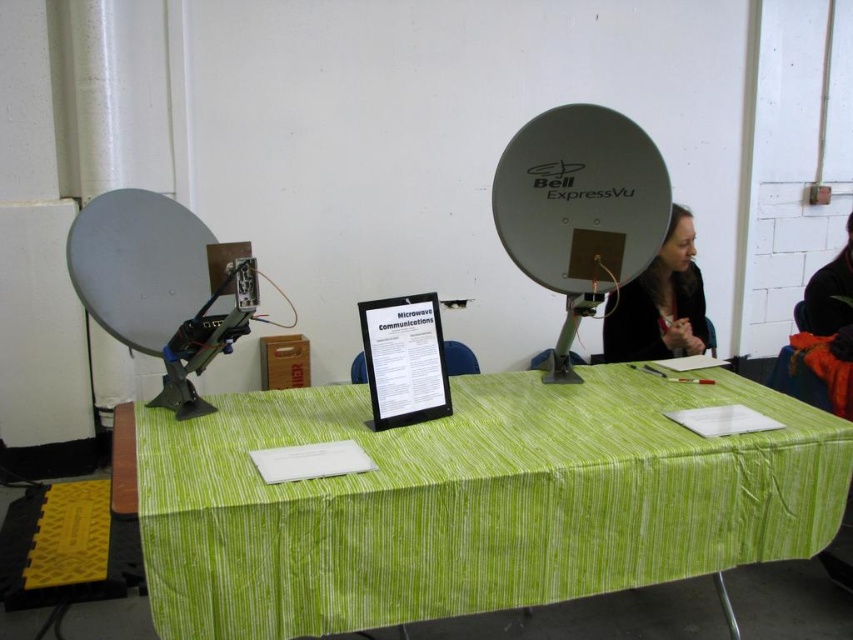
Can you confirm if green striped tablecloth at center is shorter than smooth black hair at upper right?

Correct, green striped tablecloth at center is not as tall as smooth black hair at upper right.

Can you confirm if green striped tablecloth at center is positioned to the right of smooth black hair at upper right?

Incorrect, green striped tablecloth at center is not on the right side of smooth black hair at upper right.

This screenshot has height=640, width=853. Find the location of `green striped tablecloth at center`. green striped tablecloth at center is located at coordinates click(x=473, y=500).